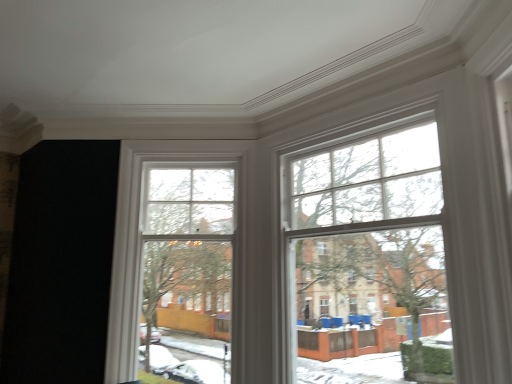
Question: Would you say clear glass window at center, which is the 2th bay window from right to left, is inside or outside clear glass window at upper right, which appears as the first bay window when viewed from the right?

Choices:
 (A) outside
 (B) inside

Answer: (A)

Question: Is clear glass window at center, which is the 2th bay window from right to left, bigger or smaller than clear glass window at upper right, which appears as the first bay window when viewed from the right?

Choices:
 (A) small
 (B) big

Answer: (A)

Question: Considering the relative positions of clear glass window at center, which is the 2th bay window from right to left, and clear glass window at upper right, which appears as the first bay window when viewed from the right, in the image provided, is clear glass window at center, which is the 2th bay window from right to left, to the left or to the right of clear glass window at upper right, which appears as the first bay window when viewed from the right,?

Choices:
 (A) right
 (B) left

Answer: (B)

Question: Does point (375, 130) appear closer or farther from the camera than point (206, 213)?

Choices:
 (A) closer
 (B) farther

Answer: (A)

Question: From a real-world perspective, is clear glass window at upper right, which appears as the first bay window when viewed from the right, positioned above or below clear glass window at center, which is the 2th bay window from right to left?

Choices:
 (A) above
 (B) below

Answer: (A)

Question: From their relative heights in the image, would you say clear glass window at upper right, which appears as the first bay window when viewed from the right, is taller or shorter than clear glass window at center, which is the 2th bay window from right to left?

Choices:
 (A) tall
 (B) short

Answer: (B)

Question: Relative to clear glass window at center, which is the 2th bay window from right to left, is clear glass window at upper right, which appears as the first bay window when viewed from the right, in front or behind?

Choices:
 (A) front
 (B) behind

Answer: (A)